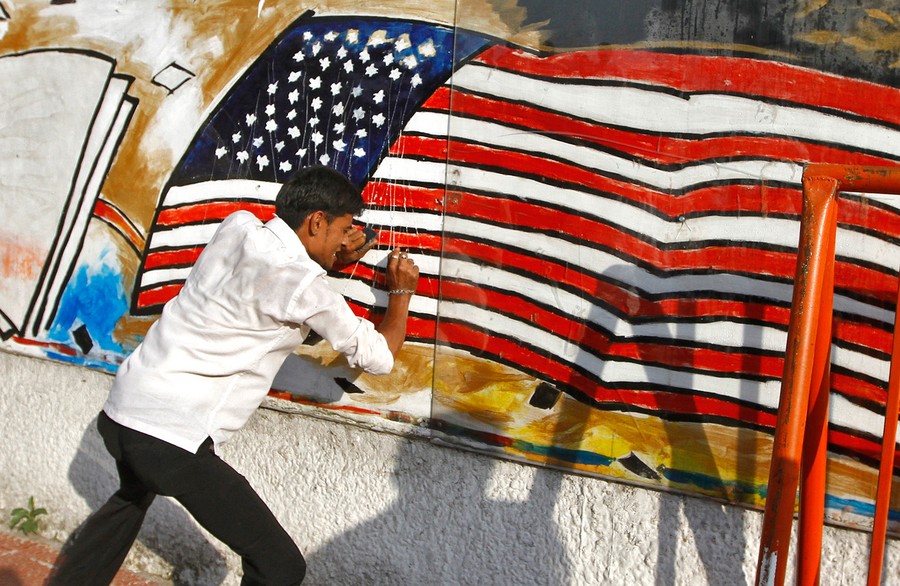
Locate an element on the screen. white wall is located at coordinates (30, 448).